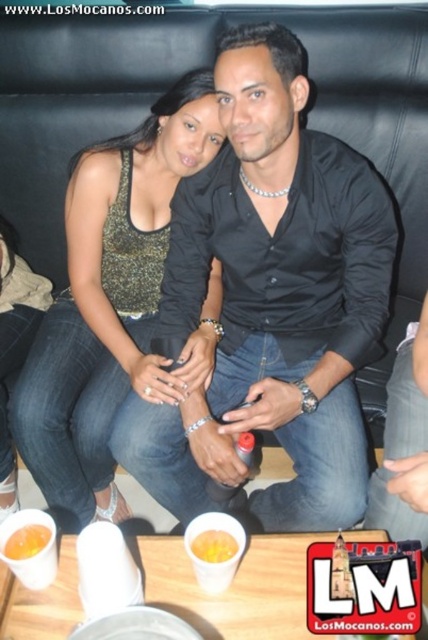
Question: In this image, where is shiny gold tank top at center located relative to yellow matte cup at center?

Choices:
 (A) below
 (B) above

Answer: (B)

Question: Which point appears farthest from the camera in this image?

Choices:
 (A) (214, 561)
 (B) (35, 544)

Answer: (B)

Question: Is shiny metallic bracelet at lower left smaller than yellow matte cup at center?

Choices:
 (A) yes
 (B) no

Answer: (B)

Question: Which object appears closest to the camera in this image?

Choices:
 (A) translucent plastic cup at lower left
 (B) yellow matte cup at center

Answer: (A)

Question: Which object is the closest to the shiny metallic bracelet at lower left?

Choices:
 (A) yellow matte cup at center
 (B) shiny gold tank top at center

Answer: (B)

Question: In this image, where is shiny metallic bracelet at lower left located relative to yellow matte cup at center?

Choices:
 (A) above
 (B) below

Answer: (A)